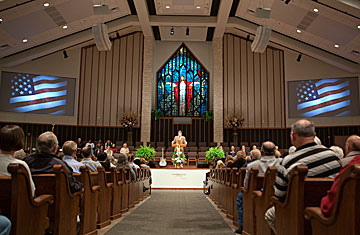
I want to click on stained glass jesus, so click(x=177, y=81).